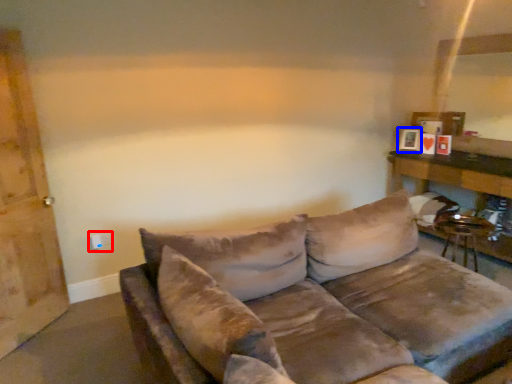
Question: Which point is further to the camera, electric outlet (highlighted by a red box) or picture frame (highlighted by a blue box)?

Choices:
 (A) electric outlet
 (B) picture frame

Answer: (B)